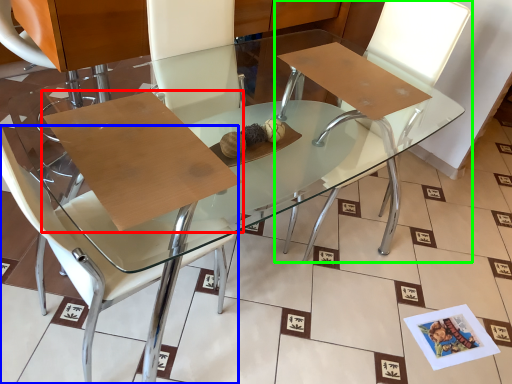
Question: Which is farther away from cardboard (highlighted by a red box)? chair (highlighted by a blue box) or chair (highlighted by a green box)?

Choices:
 (A) chair
 (B) chair

Answer: (B)